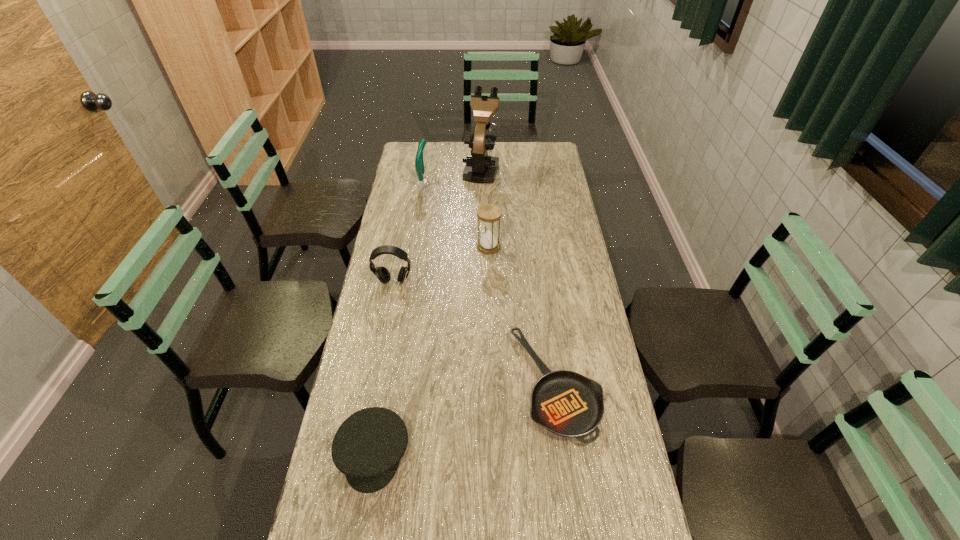
Where is `free spot between the frying pan and the second tallest object`? free spot between the frying pan and the second tallest object is located at coordinates (490, 285).

Find the location of `free space between the shortest object and the fourth farthest object`. free space between the shortest object and the fourth farthest object is located at coordinates (474, 333).

Identify the location of empty space that is in between the fourth nearest object and the bottle opener. Image resolution: width=960 pixels, height=540 pixels. (456, 216).

Locate an element on the screen. Image resolution: width=960 pixels, height=540 pixels. vacant region between the fourth nearest object and the bottle opener is located at coordinates 456,216.

The height and width of the screenshot is (540, 960). I want to click on vacant space that is in between the frying pan and the beret, so click(x=465, y=419).

I want to click on vacant region between the third farthest object and the third nearest object, so click(x=441, y=264).

Image resolution: width=960 pixels, height=540 pixels. Identify the location of free space between the fifth tallest object and the rightmost object. (465, 419).

I want to click on vacant space that is in between the hourglass and the rightmost object, so click(x=522, y=316).

Locate an element on the screen. object that is the second closest to the microscope is located at coordinates (489, 214).

Point out which object is positioned as the nearest to the hourglass. Please provide its 2D coordinates. Your answer should be formatted as a tuple, i.e. [(x, y)], where the tuple contains the x and y coordinates of a point satisfying the conditions above.

[(383, 275)]